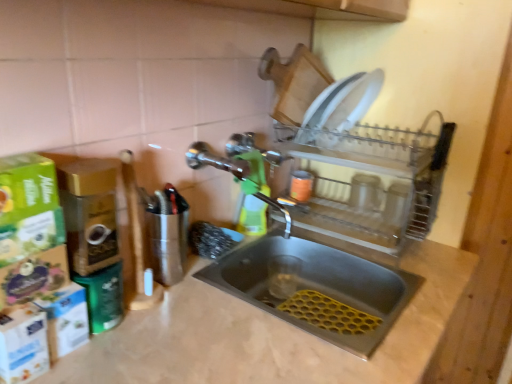
Identify the location of polished chrome tap at center. (215, 160).

Looking at this image, what is the approximate width of green plastic spray bottle at center?

It is 7.12 centimeters.

What is the approximate height of green plastic spray bottle at center?

green plastic spray bottle at center is 20.40 centimeters tall.

Identify the location of clear plastic dish rack at upper right. The width and height of the screenshot is (512, 384). (377, 184).

Locate an element on the screen. The width and height of the screenshot is (512, 384). stainless steel sink at center is located at coordinates (314, 286).

Which object is further away from the camera taking this photo, polished chrome tap at center or beige marble counter top at center?

polished chrome tap at center is behind.

Which of these two, polished chrome tap at center or beige marble counter top at center, is bigger?

beige marble counter top at center is bigger.

From a real-world perspective, does polished chrome tap at center sit lower than beige marble counter top at center?

No, from a real-world perspective, polished chrome tap at center is not below beige marble counter top at center.

Is green plastic spray bottle at center shorter than beige marble counter top at center?

Correct, green plastic spray bottle at center is not as tall as beige marble counter top at center.

Is green plastic spray bottle at center to the left or to the right of beige marble counter top at center in the image?

Based on their positions, green plastic spray bottle at center is located to the left of beige marble counter top at center.

From the picture: Which object is thinner, green plastic spray bottle at center or beige marble counter top at center?

green plastic spray bottle at center is thinner.

From a real-world perspective, is polished chrome tap at center positioned under green plastic spray bottle at center based on gravity?

Incorrect, from a real-world perspective, polished chrome tap at center is higher than green plastic spray bottle at center.

Do you think polished chrome tap at center is within green plastic spray bottle at center, or outside of it?

polished chrome tap at center is outside green plastic spray bottle at center.

Is there a large distance between polished chrome tap at center and green plastic spray bottle at center?

That's not correct — polished chrome tap at center is a little close to green plastic spray bottle at center.

Between point (335, 258) and point (262, 189), which one is positioned behind?

Positioned behind is point (335, 258).

How different are the orientations of stainless steel sink at center and green plastic spray bottle at center in degrees?

The angular difference between stainless steel sink at center and green plastic spray bottle at center is 2.03 degrees.

The width and height of the screenshot is (512, 384). In order to click on sink below the green plastic spray bottle at center (from a real-world perspective) in this screenshot , I will do `click(314, 286)`.

Is green plastic spray bottle at center completely or partially inside stainless steel sink at center?

No, green plastic spray bottle at center is located outside of stainless steel sink at center.

From a real-world perspective, is green plastic spray bottle at center physically located above or below clear plastic dish rack at upper right?

From a real-world perspective, green plastic spray bottle at center is physically below clear plastic dish rack at upper right.

Where is `cleaning product behind the clear plastic dish rack at upper right`? cleaning product behind the clear plastic dish rack at upper right is located at coordinates (252, 196).

In the image, is green plastic spray bottle at center positioned in front of or behind clear plastic dish rack at upper right?

green plastic spray bottle at center is behind clear plastic dish rack at upper right.

Between point (236, 226) and point (373, 234), which one is positioned in front?

Point (373, 234)

At what (x,y) coordinates should I click in order to perform the action: click on counter top on the right of stainless steel sink at center. Please return your answer as a coordinate pair (x, y). The height and width of the screenshot is (384, 512). Looking at the image, I should click on click(x=269, y=333).

Can you confirm if beige marble counter top at center is shorter than stainless steel sink at center?

No.

From a real-world perspective, is beige marble counter top at center above or below stainless steel sink at center?

Clearly, from a real-world perspective, beige marble counter top at center is below stainless steel sink at center.

Is beige marble counter top at center positioned far away from stainless steel sink at center?

No, beige marble counter top at center is not far from stainless steel sink at center.

Between clear plastic dish rack at upper right and polished chrome tap at center, which one appears on the left side from the viewer's perspective?

Positioned to the left is polished chrome tap at center.

Is clear plastic dish rack at upper right positioned behind polished chrome tap at center?

Yes, clear plastic dish rack at upper right is behind polished chrome tap at center.

Is clear plastic dish rack at upper right next to polished chrome tap at center and touching it?

No, clear plastic dish rack at upper right is not making contact with polished chrome tap at center.

Is clear plastic dish rack at upper right oriented away from polished chrome tap at center?

No, polished chrome tap at center is not at the back of clear plastic dish rack at upper right.

Locate an element on the screen. tap lying on the left of beige marble counter top at center is located at coordinates (215, 160).

You are a GUI agent. You are given a task and a screenshot of the screen. Output one action in this format:
    pyautogui.click(x=<x>, y=<y>)
    Task: Click on the counter top that is below the green plastic spray bottle at center (from the image's perspective)
    The height and width of the screenshot is (384, 512).
    Given the screenshot: What is the action you would take?
    pyautogui.click(x=269, y=333)

Based on their spatial positions, is green plastic spray bottle at center or beige marble counter top at center further from stainless steel sink at center?

Based on the image, green plastic spray bottle at center appears to be further to stainless steel sink at center.

Based on their spatial positions, is beige marble counter top at center or polished chrome tap at center further from clear plastic dish rack at upper right?

polished chrome tap at center is positioned further to the anchor clear plastic dish rack at upper right.

Which object lies further to the anchor point stainless steel sink at center, clear plastic dish rack at upper right or green plastic spray bottle at center?

clear plastic dish rack at upper right is further to stainless steel sink at center.

Considering their positions, is polished chrome tap at center positioned closer to beige marble counter top at center than green plastic spray bottle at center?

green plastic spray bottle at center is closer to beige marble counter top at center.

From the image, which object appears to be nearer to stainless steel sink at center, beige marble counter top at center or clear plastic dish rack at upper right?

Based on the image, beige marble counter top at center appears to be nearer to stainless steel sink at center.

Based on their spatial positions, is beige marble counter top at center or polished chrome tap at center further from stainless steel sink at center?

polished chrome tap at center is further to stainless steel sink at center.

When comparing their distances from clear plastic dish rack at upper right, does stainless steel sink at center or green plastic spray bottle at center seem further?

green plastic spray bottle at center is positioned further to the anchor clear plastic dish rack at upper right.

Estimate the real-world distances between objects in this image. Which object is closer to beige marble counter top at center, green plastic spray bottle at center or stainless steel sink at center?

stainless steel sink at center is positioned closer to the anchor beige marble counter top at center.

Locate an element on the screen. appliance between polished chrome tap at center and stainless steel sink at center vertically is located at coordinates (377, 184).

The width and height of the screenshot is (512, 384). I want to click on sink between green plastic spray bottle at center and beige marble counter top at center in the up-down direction, so click(314, 286).

Where is `appliance between stainless steel sink at center and green plastic spray bottle at center from front to back`? This screenshot has height=384, width=512. appliance between stainless steel sink at center and green plastic spray bottle at center from front to back is located at coordinates (377, 184).

Image resolution: width=512 pixels, height=384 pixels. Identify the location of cleaning product located between polished chrome tap at center and clear plastic dish rack at upper right in the left-right direction. (252, 196).